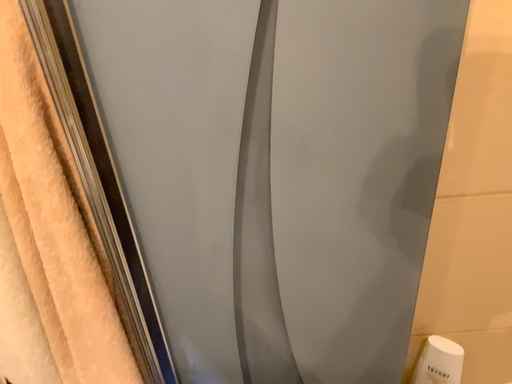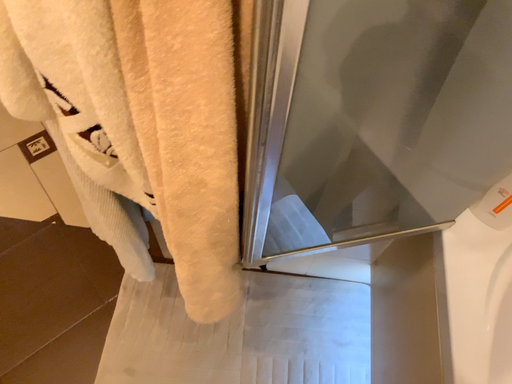
Question: Which way did the camera rotate in the video?

Choices:
 (A) rotated downward
 (B) rotated upward

Answer: (A)